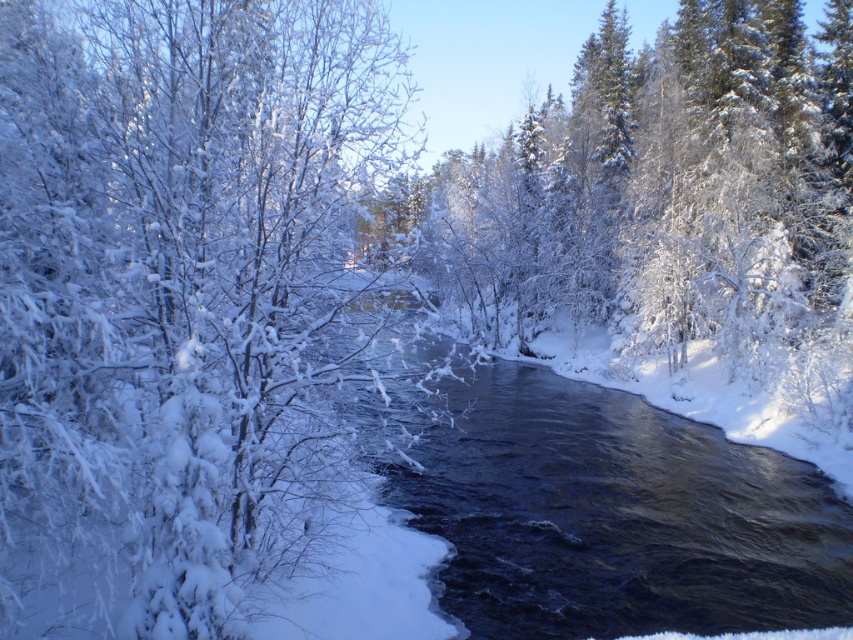
Does snowy white branches at left have a smaller size compared to dark blue water at center?

Incorrect, snowy white branches at left is not smaller in size than dark blue water at center.

Is snowy white branches at left wider than dark blue water at center?

In fact, snowy white branches at left might be narrower than dark blue water at center.

What do you see at coordinates (173, 296) in the screenshot?
I see `snowy white branches at left` at bounding box center [173, 296].

Find the location of a particular element. The height and width of the screenshot is (640, 853). snowy white branches at left is located at coordinates (173, 296).